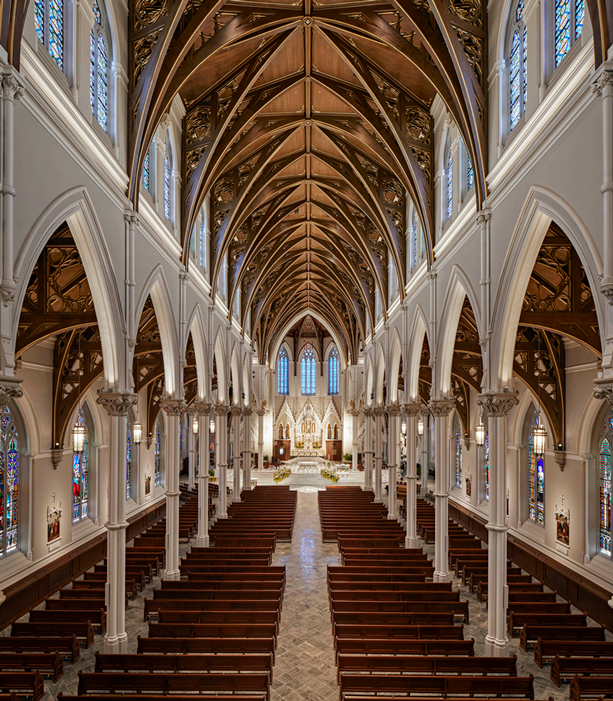
Locate an element on the screen. Image resolution: width=613 pixels, height=701 pixels. window is located at coordinates (10, 421).